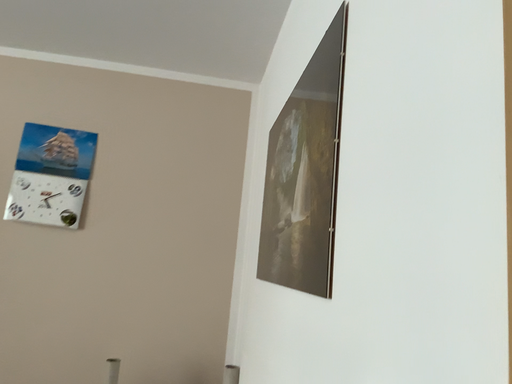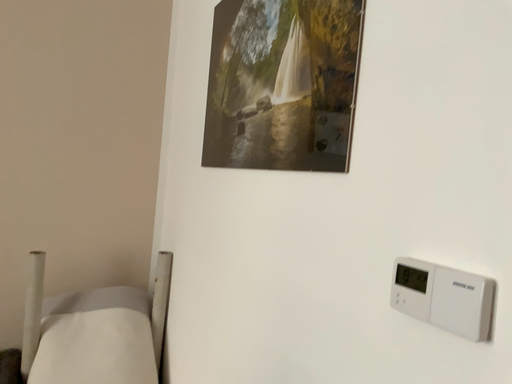
Question: How did the camera likely rotate when shooting the video?

Choices:
 (A) rotated left
 (B) rotated right

Answer: (B)